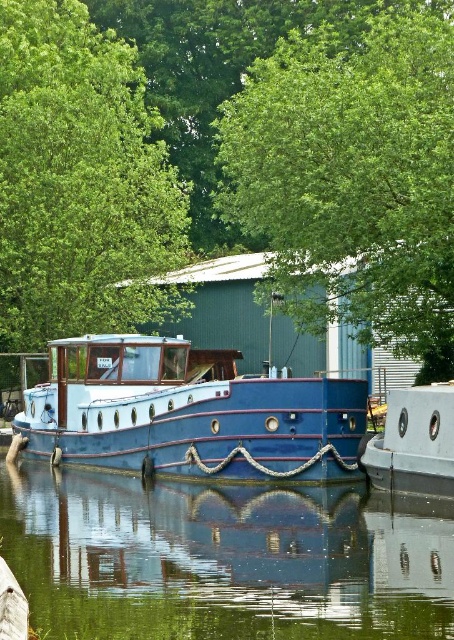
You are standing on the quay next to the blue and white canal boat docked at the quay. There is a point at coordinates (222, 560) on the image. What is located at that point?

The point at coordinates (222, 560) indicates transparent glass water at center.

You are a photographer planning to take a photo of the matte blue boat at center and the green leafy tree at upper left. Which object should you focus on first if you want to capture both in a single frame without moving the camera?

The green leafy tree at upper left is positioned on the left side of the matte blue boat at center, so you should focus on the green leafy tree at upper left first to ensure both are in frame.

You are an architect designing a new riverside park and want to include both a green leafy tree at upper center and a metallic blue boat at center. Based on the scene, which object should be placed first in terms of size when planning the layout?

The green leafy tree at upper center should be placed first because it is bigger than the metallic blue boat at center, ensuring proper scaling in the design.